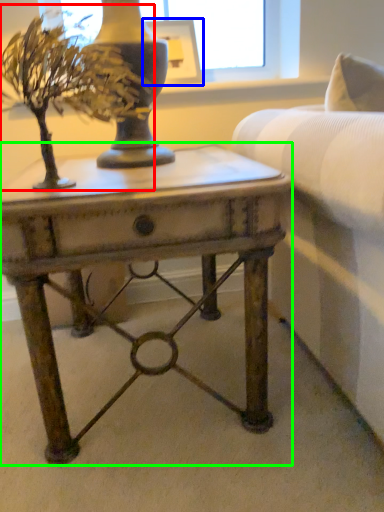
Question: Considering the real-world distances, which object is closest to houseplant (highlighted by a red box)? picture frame (highlighted by a blue box) or table (highlighted by a green box).

Choices:
 (A) picture frame
 (B) table

Answer: (B)